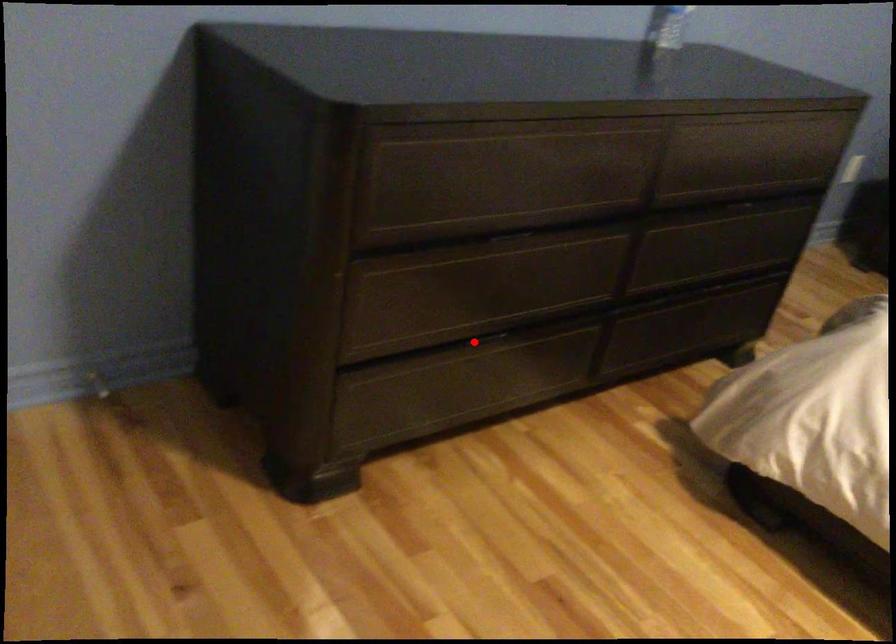
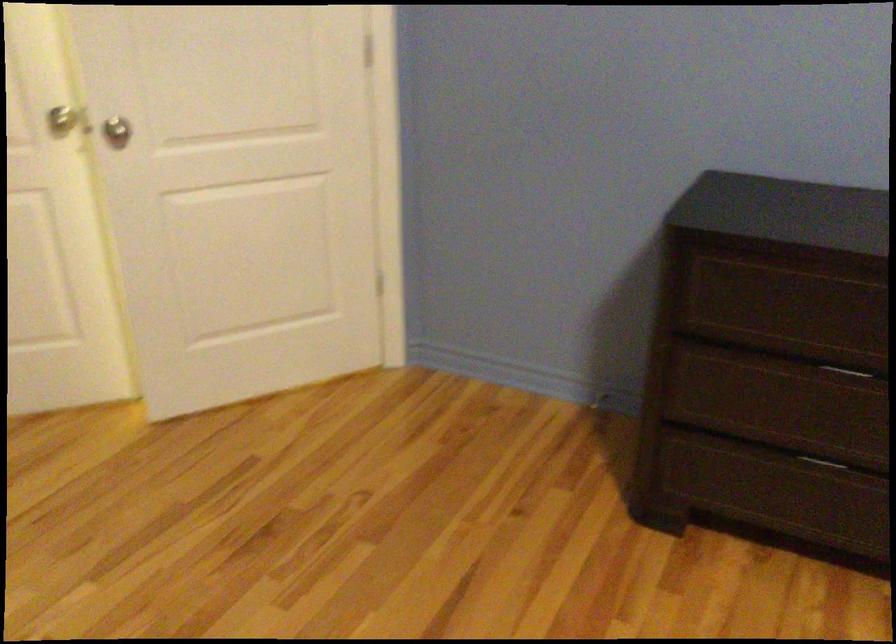
Find the pixel in the second image that matches the highlighted location in the first image.

(821, 462)